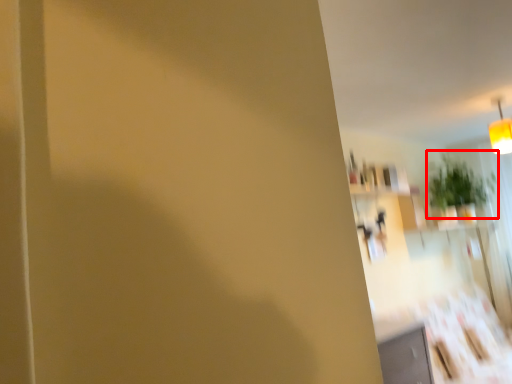
Question: From the image's perspective, where is plant (annotated by the red box) located relative to light fixture?

Choices:
 (A) below
 (B) above

Answer: (A)